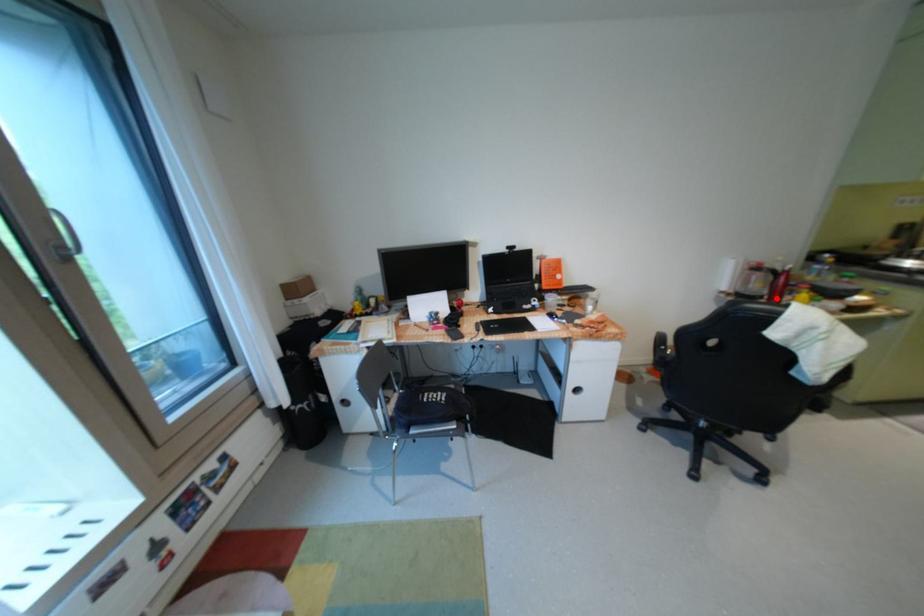
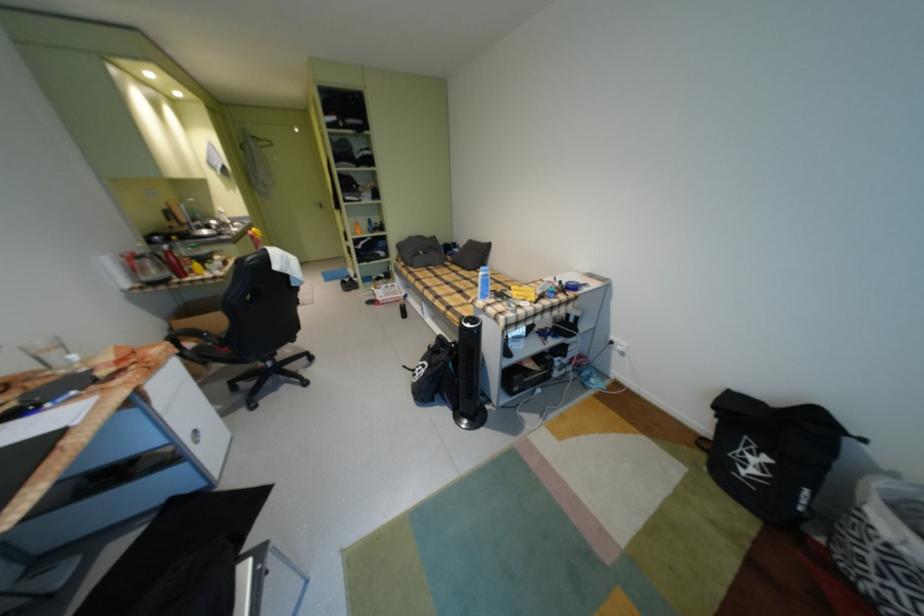
The point at the highlighted location is marked in the first image. Where is the corresponding point in the second image?

(185, 277)